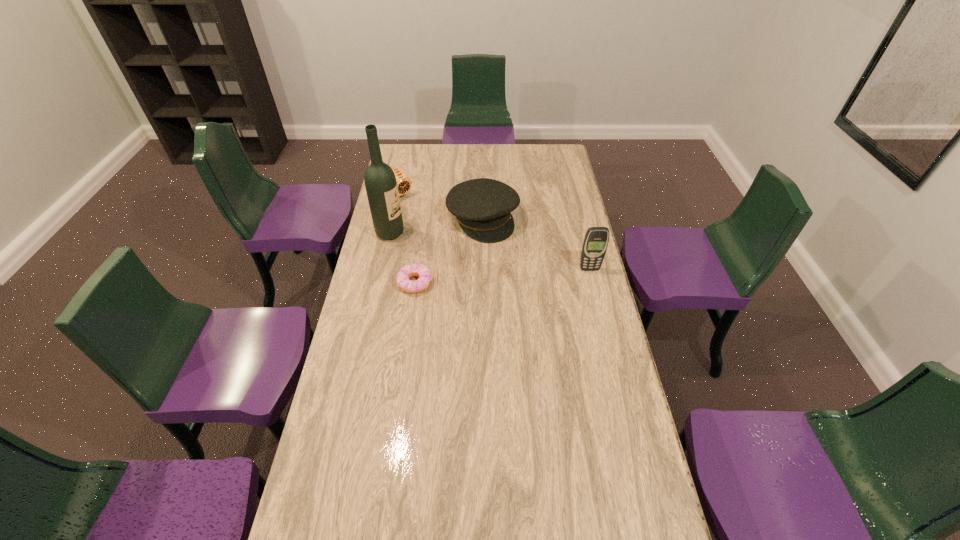
At what (x,y) coordinates should I click in order to perform the action: click on doughnut. Please return your answer as a coordinate pair (x, y). Image resolution: width=960 pixels, height=540 pixels. Looking at the image, I should click on (402, 278).

Where is `the rightmost object`? the rightmost object is located at coordinates (596, 239).

Find the location of a particular element. This screenshot has width=960, height=540. the second tallest object is located at coordinates (596, 239).

Find the location of a particular element. Image resolution: width=960 pixels, height=540 pixels. watch is located at coordinates (403, 182).

Image resolution: width=960 pixels, height=540 pixels. Identify the location of beret. pyautogui.click(x=482, y=207).

At what (x,y) coordinates should I click in order to perform the action: click on wine bottle. Please return your answer as a coordinate pair (x, y). Looking at the image, I should click on (381, 186).

Where is `free space located on the back of the shortest object`? free space located on the back of the shortest object is located at coordinates (421, 240).

Identify the location of vacant point located on the screen of the rightmost object. The height and width of the screenshot is (540, 960). (608, 343).

Locate an element on the screen. The width and height of the screenshot is (960, 540). vacant space located on the face of the watch is located at coordinates (447, 237).

What are the coordinates of `vacant space located 0.360m on the face of the watch` in the screenshot? It's located at (453, 241).